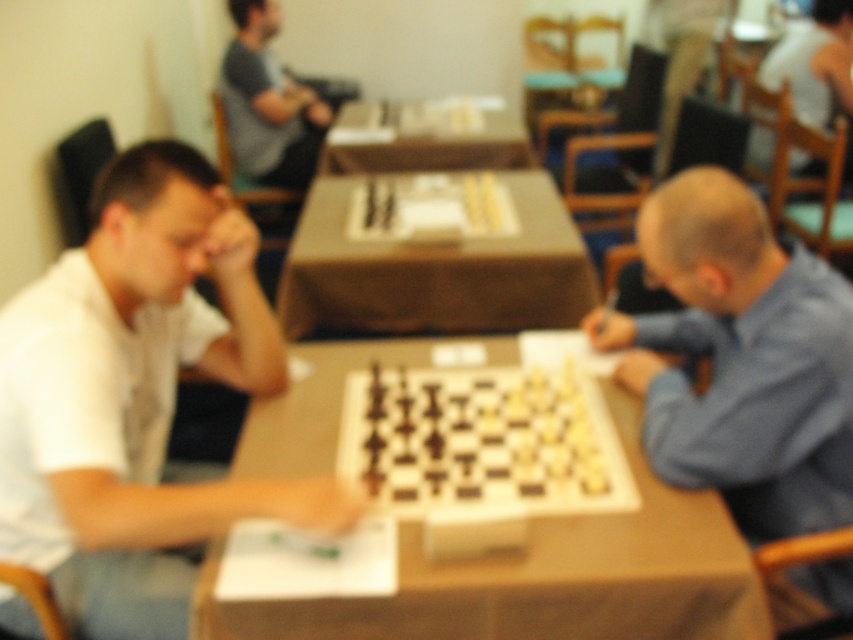
You are a delivery robot with a 2.5 meter arm reach. You need to place a chess piece between the blue fabric shirt at right and the white shirt at upper right. Can your arm reach that far?

The distance between the blue fabric shirt at right and the white shirt at upper right is 2.65 meters, which is slightly beyond the robot arm reach of 2.5 meters. The robot cannot reach that far.

You are a photographer trying to capture a closeup of the wooden at center while also including the gray fabric shirt at upper center in the frame. Given their sizes, which object should you adjust your camera angle to prioritize to ensure both are fully visible?

The wooden at center is wider than the gray fabric shirt at upper center, so you should adjust your camera angle to prioritize capturing the wider wooden at center first to ensure both objects are fully visible.